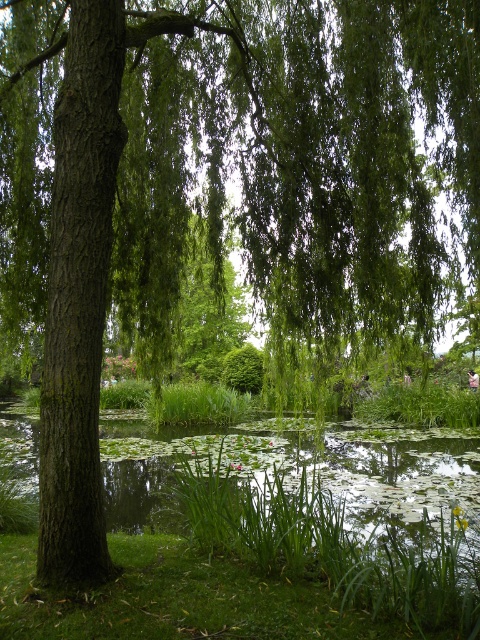
Based on the photo, is green grassy lake at lower left above green grass at lower center?

No.

Between green grassy lake at lower left and green grass at lower center, which one has less height?

Standing shorter between the two is green grass at lower center.

Does point (130, 509) lie behind point (204, 600)?

Yes.

Find the location of a particular element. The width and height of the screenshot is (480, 640). green grassy lake at lower left is located at coordinates pyautogui.click(x=298, y=465).